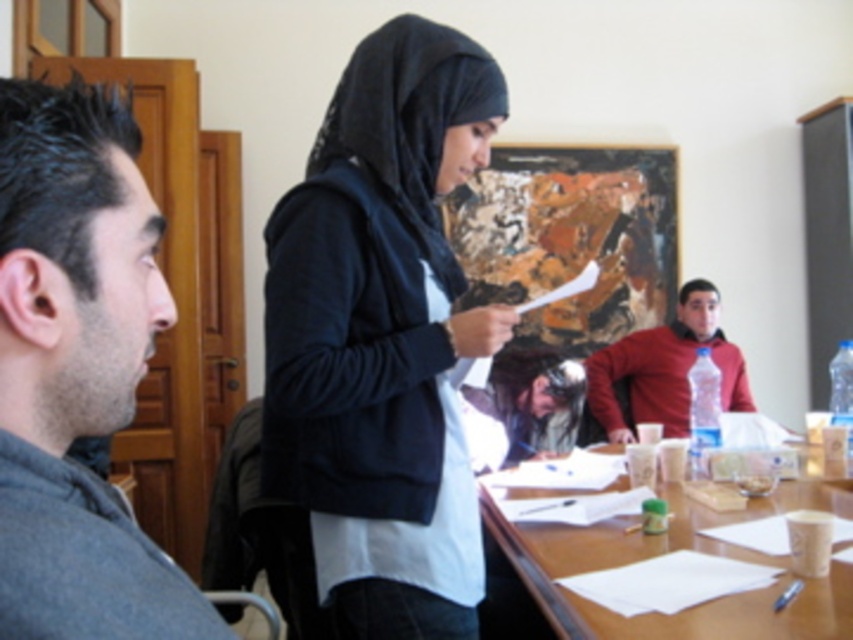
Question: Which is farther from the matte plastic water bottle at right?

Choices:
 (A) dark gray shirt at left
 (B) wooden table at center

Answer: (A)

Question: Can you confirm if black matte hijab at center is positioned to the right of matte plastic water bottle at right?

Choices:
 (A) no
 (B) yes

Answer: (A)

Question: Is black matte hijab at center positioned behind matte plastic water bottle at right?

Choices:
 (A) no
 (B) yes

Answer: (A)

Question: Which object is the closest to the dark gray shirt at left?

Choices:
 (A) matte plastic water bottle at right
 (B) wooden table at center

Answer: (B)

Question: Does dark gray shirt at left appear on the right side of wooden table at center?

Choices:
 (A) no
 (B) yes

Answer: (A)

Question: Among these objects, which one is farthest from the camera?

Choices:
 (A) dark gray shirt at left
 (B) matte plastic water bottle at right

Answer: (B)